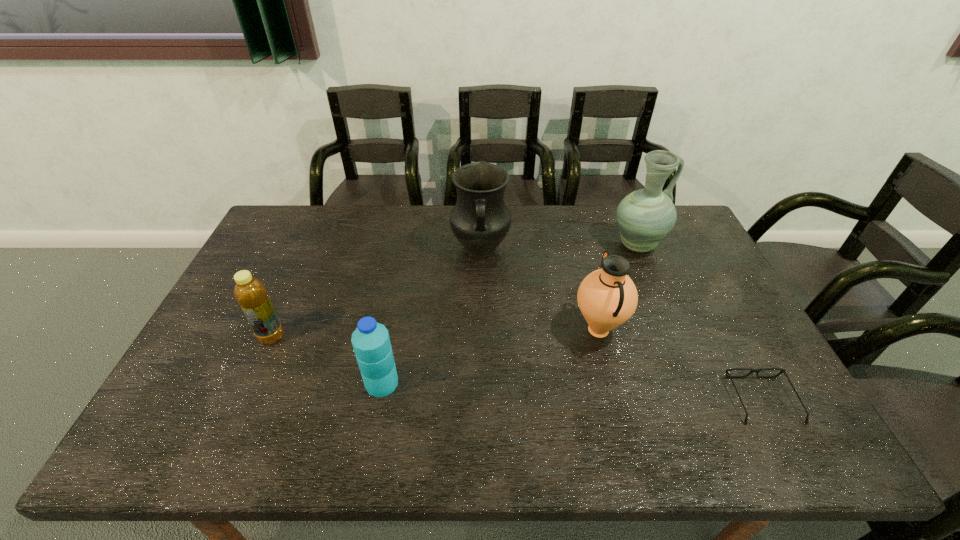
Where is `free space located on the left of the fourth object from left to right`? free space located on the left of the fourth object from left to right is located at coordinates (426, 330).

The width and height of the screenshot is (960, 540). Find the location of `free space located on the back of the leftmost object`. free space located on the back of the leftmost object is located at coordinates (304, 264).

At what (x,y) coordinates should I click in order to perform the action: click on blank area located on the left of the second object from left to right. Please return your answer as a coordinate pair (x, y). The width and height of the screenshot is (960, 540). Looking at the image, I should click on (317, 383).

You are a GUI agent. You are given a task and a screenshot of the screen. Output one action in this format:
    pyautogui.click(x=<x>, y=<y>)
    Task: Click on the vacant space located 0.060m on the front-facing side of the spectacles
    The width and height of the screenshot is (960, 540).
    Given the screenshot: What is the action you would take?
    pyautogui.click(x=740, y=357)

Identify the location of vacant space located on the front-facing side of the spectacles. The height and width of the screenshot is (540, 960). (699, 279).

The image size is (960, 540). I want to click on free space located 0.330m on the front-facing side of the spectacles, so click(x=702, y=286).

Find the location of a particular element. Image resolution: width=960 pixels, height=540 pixels. object present at the near edge is located at coordinates (727, 371).

At what (x,y) coordinates should I click in order to perform the action: click on object positioned at the left edge. Please return your answer as a coordinate pair (x, y). Looking at the image, I should click on (250, 293).

The image size is (960, 540). Find the location of `pitcher located at the right edge`. pitcher located at the right edge is located at coordinates (646, 216).

I want to click on spectacles located at the right edge, so click(x=727, y=371).